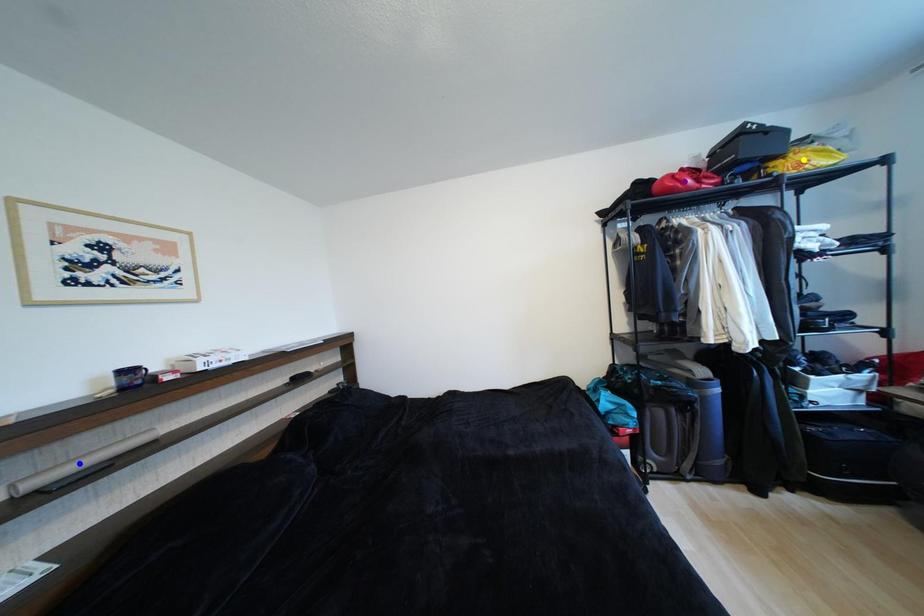
Order these from farthest to nearest:
A) blue point
B) yellow point
C) purple point

purple point < yellow point < blue point